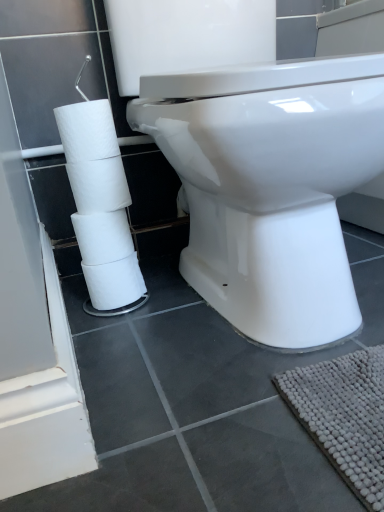
Question: From a real-world perspective, is white matte toilet paper at left physically located above or below white glossy toilet at center?

Choices:
 (A) below
 (B) above

Answer: (A)

Question: Is white matte toilet paper at left bigger or smaller than white glossy toilet at center?

Choices:
 (A) big
 (B) small

Answer: (B)

Question: Does point (92, 268) appear closer or farther from the camera than point (243, 278)?

Choices:
 (A) farther
 (B) closer

Answer: (A)

Question: From their relative heights in the image, would you say white glossy toilet at center is taller or shorter than white matte toilet paper at left?

Choices:
 (A) tall
 (B) short

Answer: (A)

Question: From a real-world perspective, is white glossy toilet at center above or below white matte toilet paper at left?

Choices:
 (A) above
 (B) below

Answer: (A)

Question: In terms of size, does white glossy toilet at center appear bigger or smaller than white matte toilet paper at left?

Choices:
 (A) small
 (B) big

Answer: (B)

Question: Which is correct: white glossy toilet at center is inside white matte toilet paper at left, or outside of it?

Choices:
 (A) inside
 (B) outside

Answer: (B)